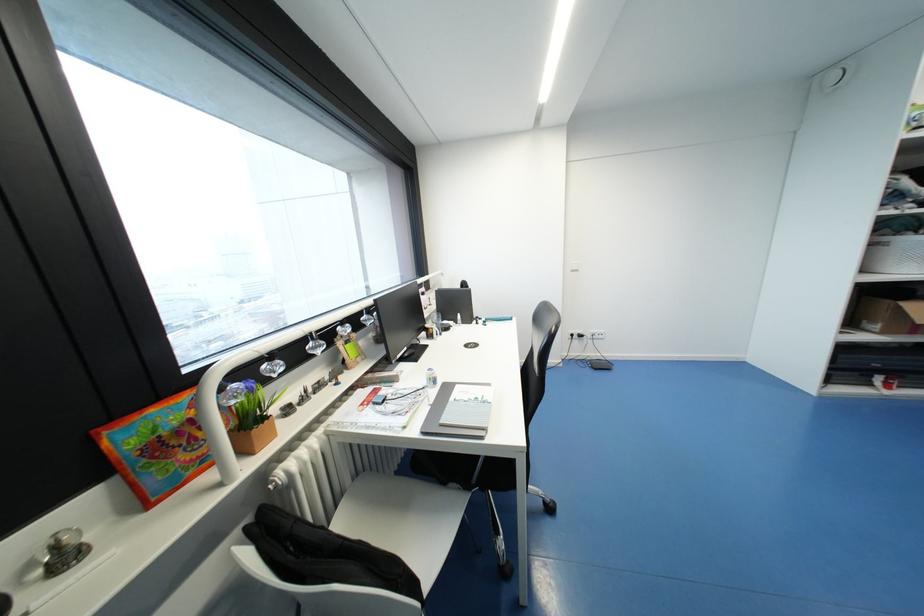
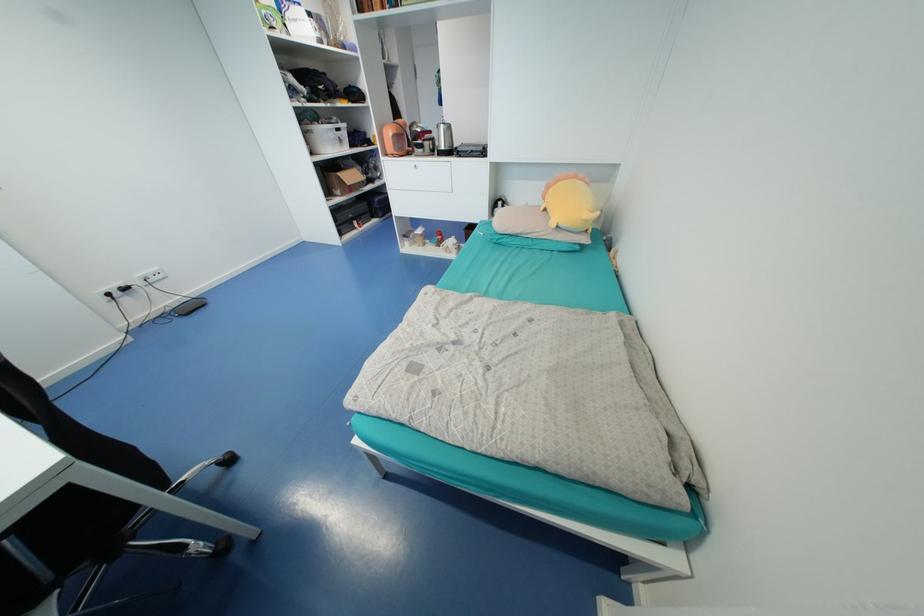
Where in the second image is the point corresponding to point (593, 360) from the first image?

(174, 310)